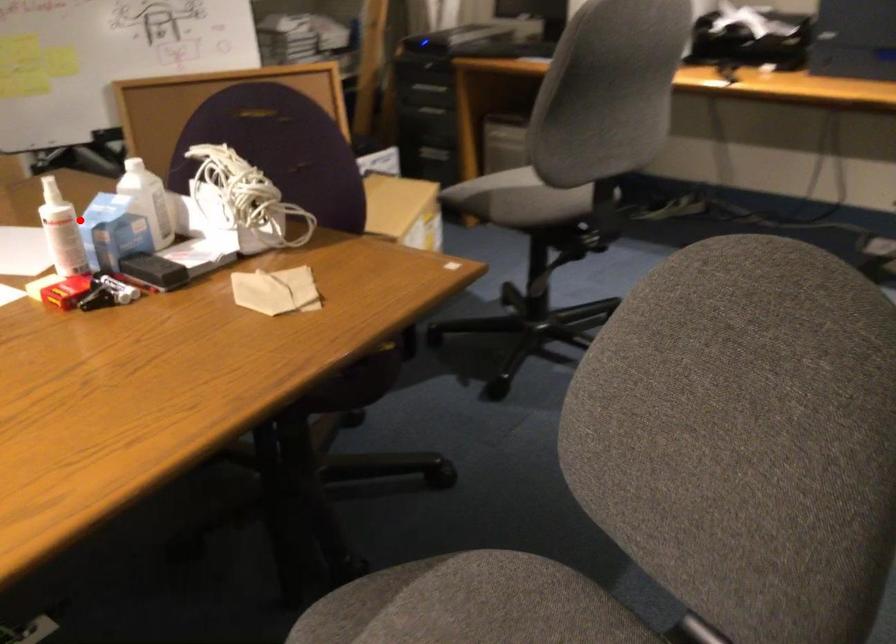
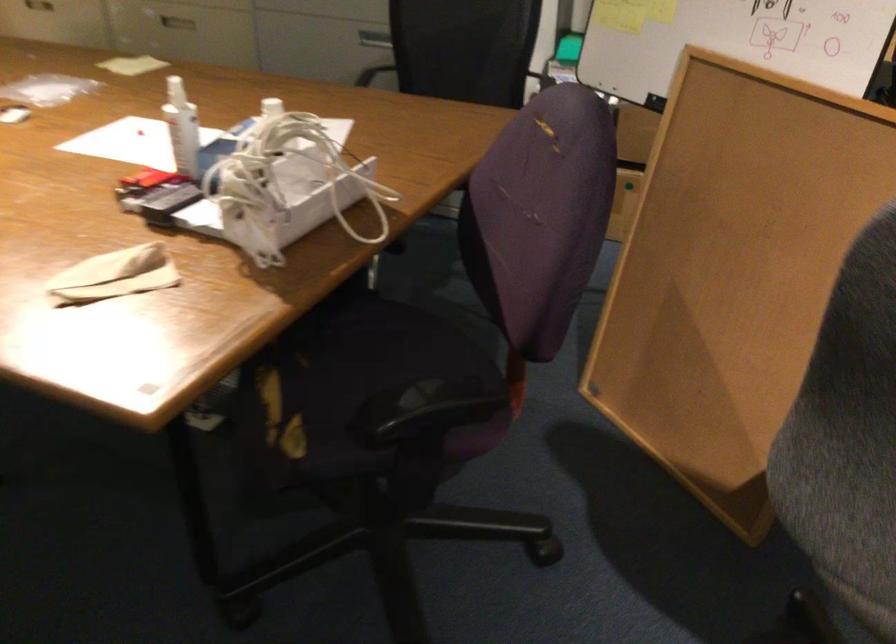
Find the pixel in the second image that matches the highlighted location in the first image.

(182, 128)